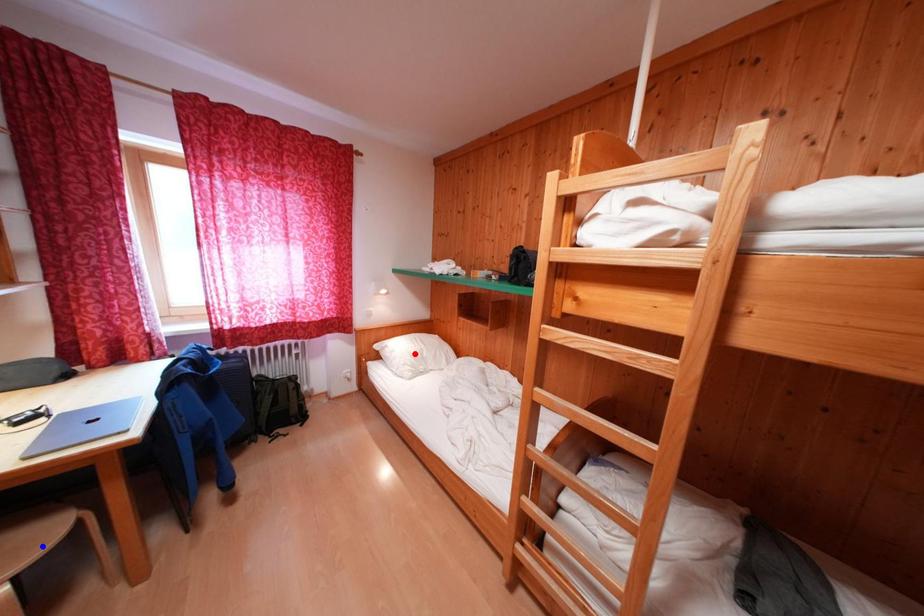
Question: Two points are marked on the image. Which point is closer to the camera?

Choices:
 (A) Blue point is closer.
 (B) Red point is closer.

Answer: (A)